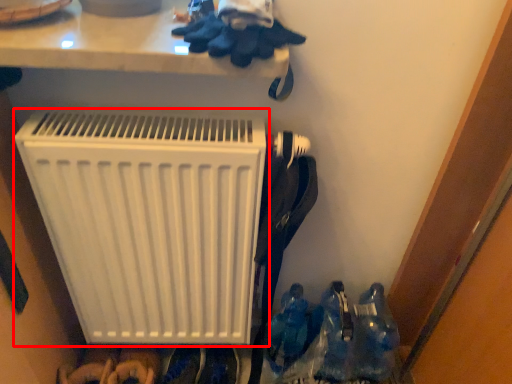
Question: From the image's perspective, what is the correct spatial relationship of home appliance (annotated by the red box) in relation to footwear?

Choices:
 (A) below
 (B) above

Answer: (B)